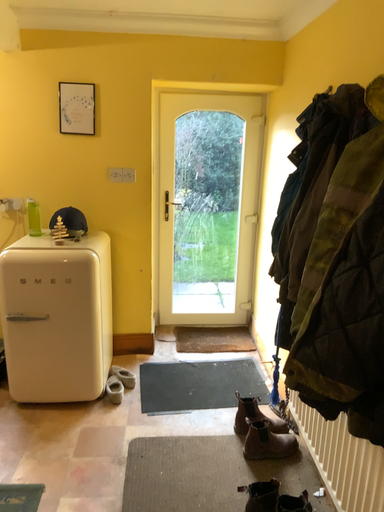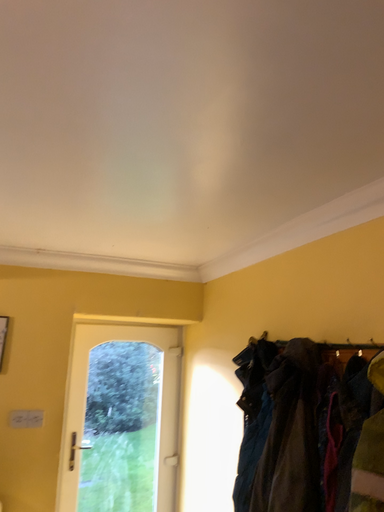
Question: How did the camera likely rotate when shooting the video?

Choices:
 (A) rotated left
 (B) rotated right

Answer: (B)